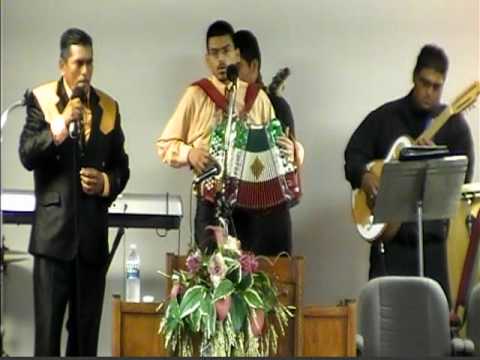
The image size is (480, 360). I want to click on chair, so click(446, 328).